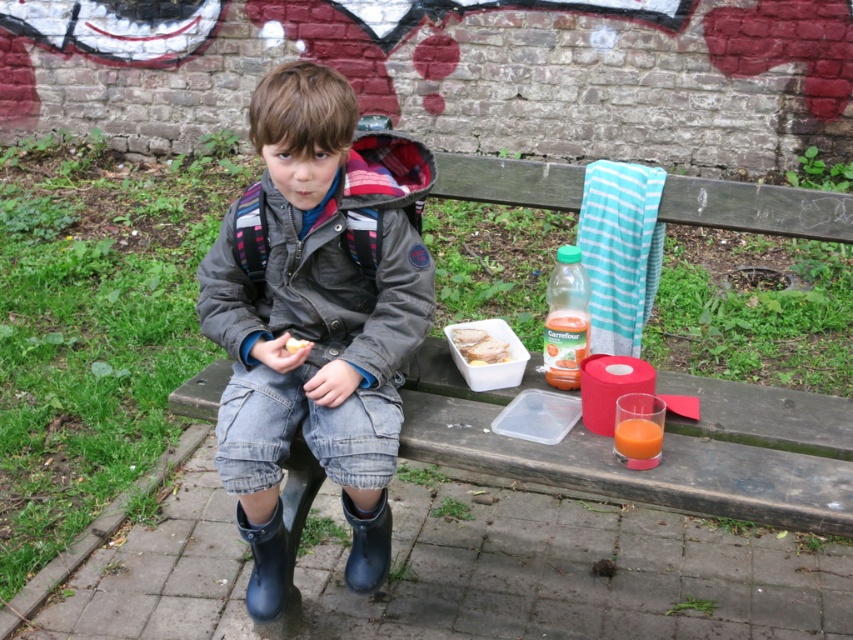
You are a delivery person who needs to place a small package between the teal striped towel at upper right and the black rubber boot at lower left. The package is 20 inches long. Is there enough space between them to fit the package?

Result: The teal striped towel at upper right is 38.55 inches away from the black rubber boot at lower left. Since the package is 20 inches long, there is sufficient space between them to fit the package.

You are a parent trying to pack up the child and their belongings. You need to place the black rubber boot at lower left and the smooth white bread at center into a bag. Which item should you put in first to ensure it fits properly?

The black rubber boot at lower left is much taller than the smooth white bread at center, so you should place the black rubber boot at lower left first to ensure it fits properly.